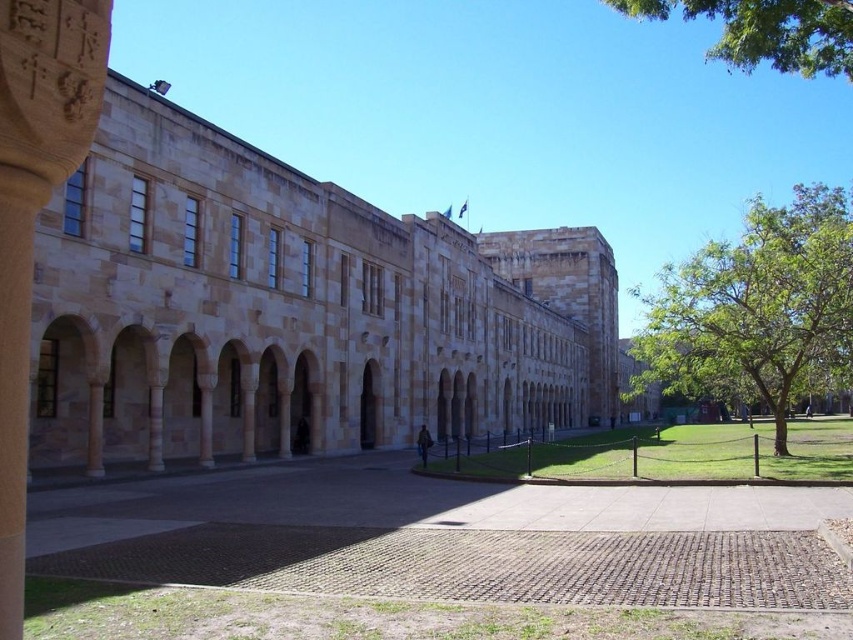
At what (x,y) coordinates should I click in order to perform the action: click on carved stone pillar at center. Please return your answer as a coordinate pair (x, y). The image size is (853, 640). Looking at the image, I should click on (33, 212).

Can you confirm if green leafy tree at right is positioned below carved stone pillar at center?

Incorrect, green leafy tree at right is not positioned below carved stone pillar at center.

Between green leafy tree at right and carved stone pillar at center, which one has less height?

carved stone pillar at center is shorter.

Which is behind, point (747, 285) or point (21, 353)?

Point (747, 285)

Locate an element on the screen. The image size is (853, 640). green leafy tree at right is located at coordinates (756, 307).

Who is lower down, green leafy tree at right or green leafy tree at upper right?

green leafy tree at right is lower down.

Identify the location of green leafy tree at right. (756, 307).

The width and height of the screenshot is (853, 640). In order to click on green leafy tree at right in this screenshot , I will do `click(756, 307)`.